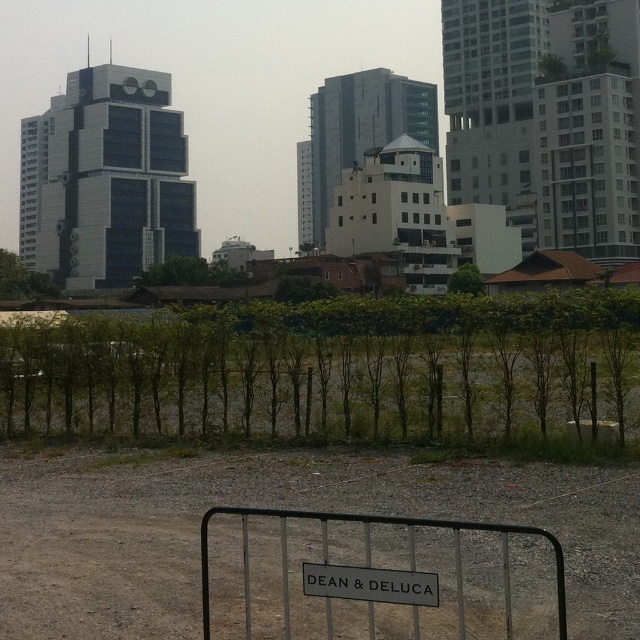
You are standing at the origin point of the image coordinate system. You want to walk to the dirt field at lower center. What are the coordinates you need to move to?

The dirt field at lower center is located at coordinates point (275, 506). So you need to move to point (275, 506).

You are a delivery person approaching the fenced area with a cart. You need to place a package near the metallic silver fence at lower center and the black metal sign at lower center. Which object should you place the package closer to if you want it to be more visible to someone standing at the entrance?

You should place the package closer to the metallic silver fence at lower center because it is closer to the viewer, making it more visible from the entrance.

Based on the photo, you are a city planner assessing a new development area. You notice the dirt field at lower center and the black metal sign at lower center. Which object occupies more space in the scene?

The dirt field at lower center is bigger than the black metal sign at lower center, so it occupies more space in the scene.